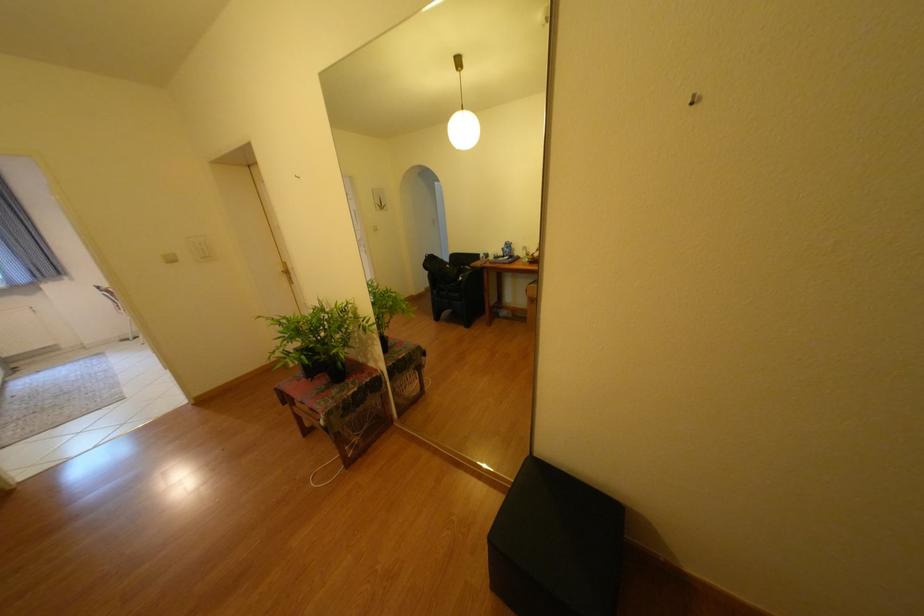
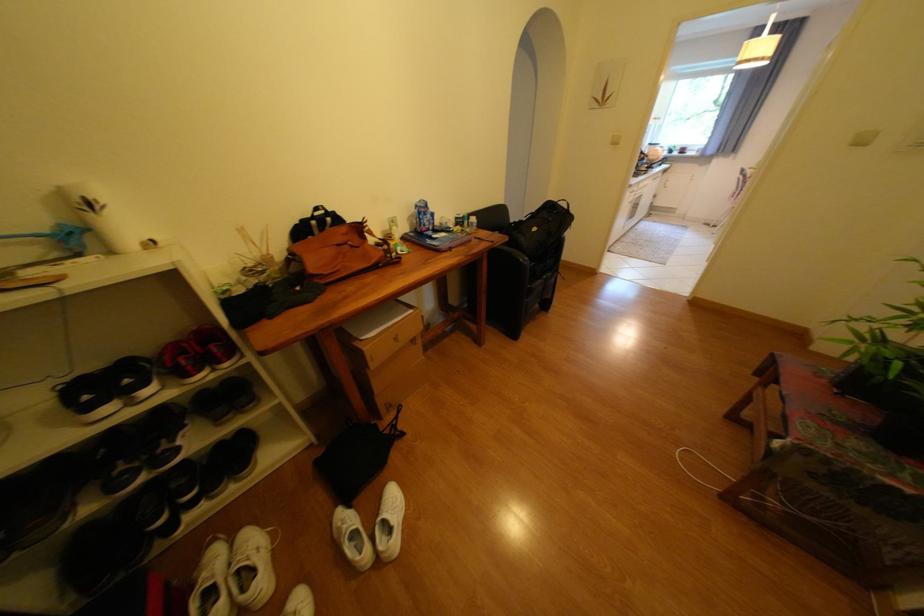
How did the camera likely rotate?

The rotation direction of the camera is left-down.